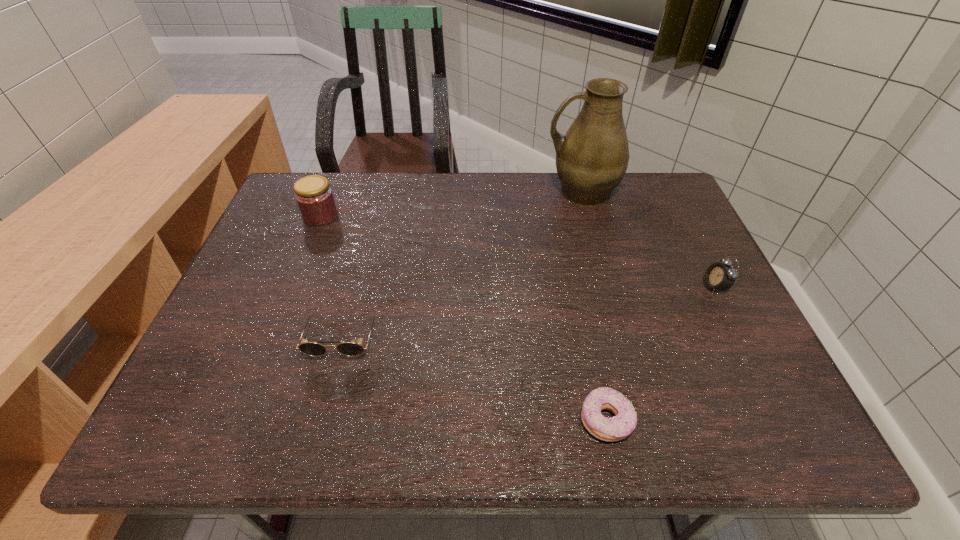
This screenshot has height=540, width=960. In order to click on free space located 0.280m on the handle side of the pitcher in this screenshot , I will do `click(451, 192)`.

Identify the location of free space located 0.200m on the handle side of the pitcher. This screenshot has height=540, width=960. (478, 192).

This screenshot has height=540, width=960. In order to click on vacant position located on the front of the jam in this screenshot , I will do `click(299, 271)`.

Locate an element on the screen. free space located on the face of the third tallest object is located at coordinates (568, 287).

What are the coordinates of `free region located on the face of the third tallest object` in the screenshot? It's located at click(x=655, y=287).

Locate an element on the screen. The height and width of the screenshot is (540, 960). vacant space situated on the face of the third tallest object is located at coordinates (679, 287).

This screenshot has height=540, width=960. Identify the location of vacant space located on the front lenses of the second shortest object. (331, 383).

Locate an element on the screen. The height and width of the screenshot is (540, 960). free space located on the back of the doughnut is located at coordinates (571, 257).

This screenshot has width=960, height=540. In order to click on pitcher that is at the far edge in this screenshot , I will do `click(592, 158)`.

What are the coordinates of `jam positioned at the far edge` in the screenshot? It's located at (315, 199).